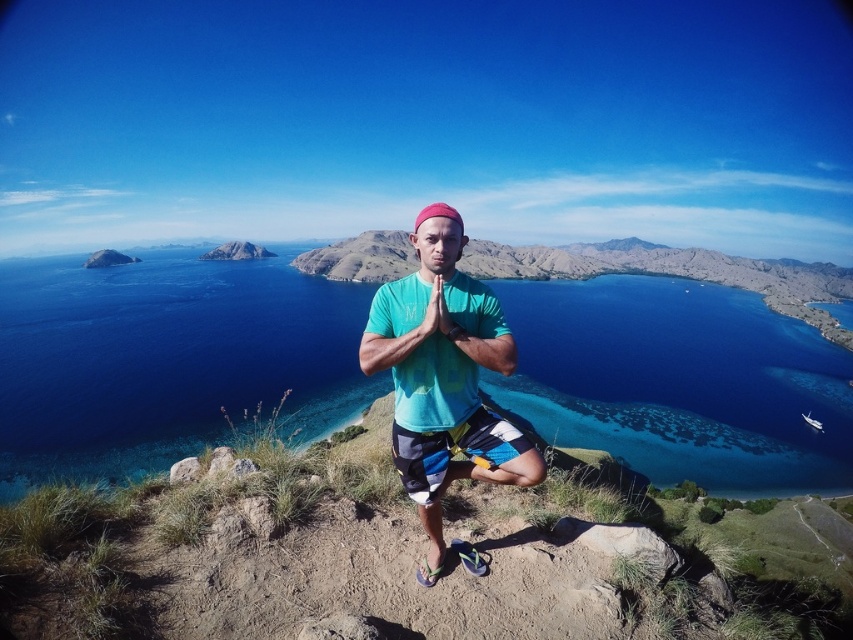
Does teal cotton shirt at center have a greater height compared to striped cotton shorts at center?

Yes, teal cotton shirt at center is taller than striped cotton shorts at center.

Is the position of teal cotton shirt at center less distant than that of striped cotton shorts at center?

Yes.

Where is `teal cotton shirt at center`? teal cotton shirt at center is located at coordinates (444, 376).

Is blue water at center shorter than striped cotton shorts at center?

No, blue water at center is not shorter than striped cotton shorts at center.

Is point (329, 300) behind point (473, 458)?

Yes.

Between point (842, 394) and point (490, 433), which one is positioned in front?

Point (490, 433)

This screenshot has height=640, width=853. I want to click on blue water at center, so click(166, 358).

Does blue water at center have a larger size compared to teal cotton shirt at center?

Correct, blue water at center is larger in size than teal cotton shirt at center.

Does blue water at center appear over teal cotton shirt at center?

Yes, blue water at center is above teal cotton shirt at center.

Does point (717, 304) lie behind point (456, 468)?

Yes, it is.

What are the coordinates of `blue water at center` in the screenshot? It's located at (166, 358).